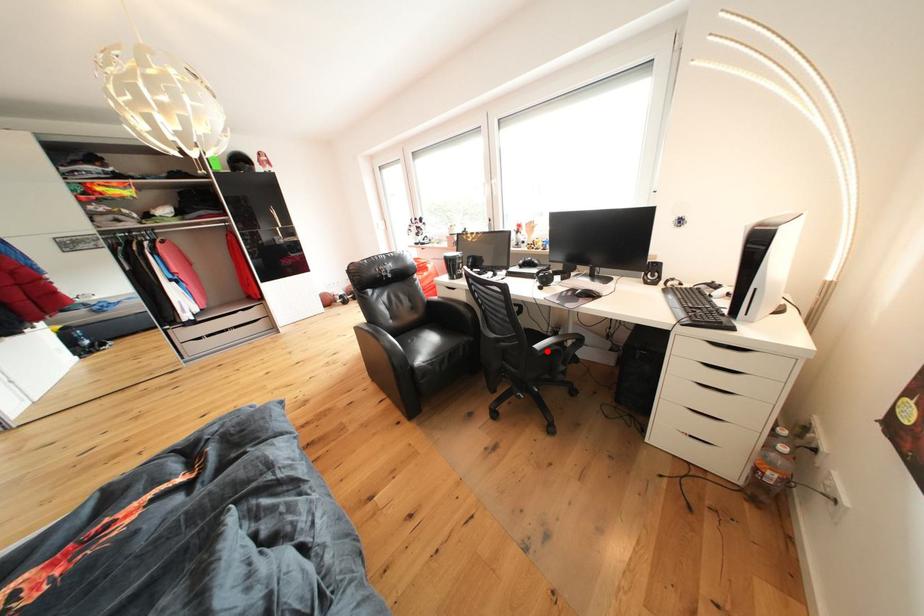
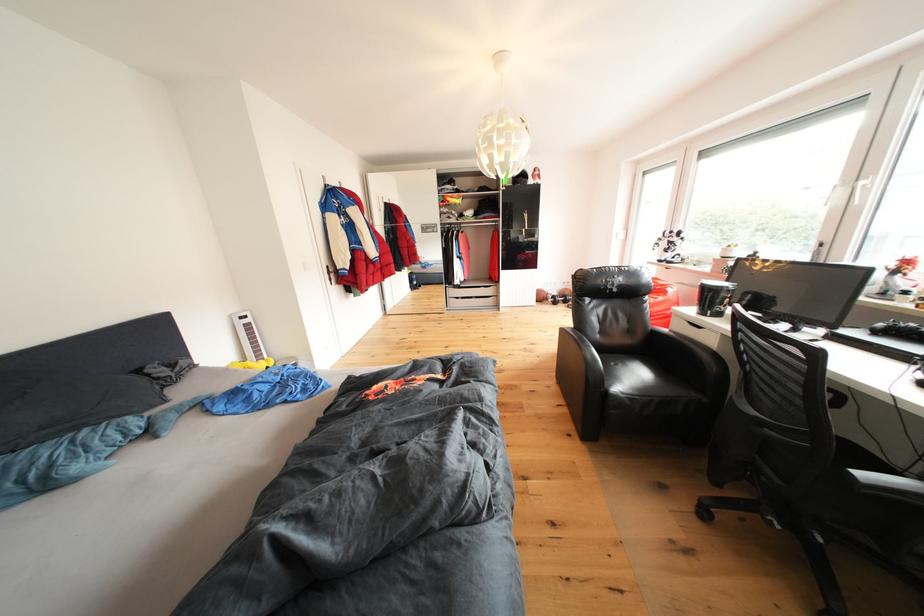
Locate, in the second image, the point that corresponds to the highlighted location in the first image.

(872, 480)